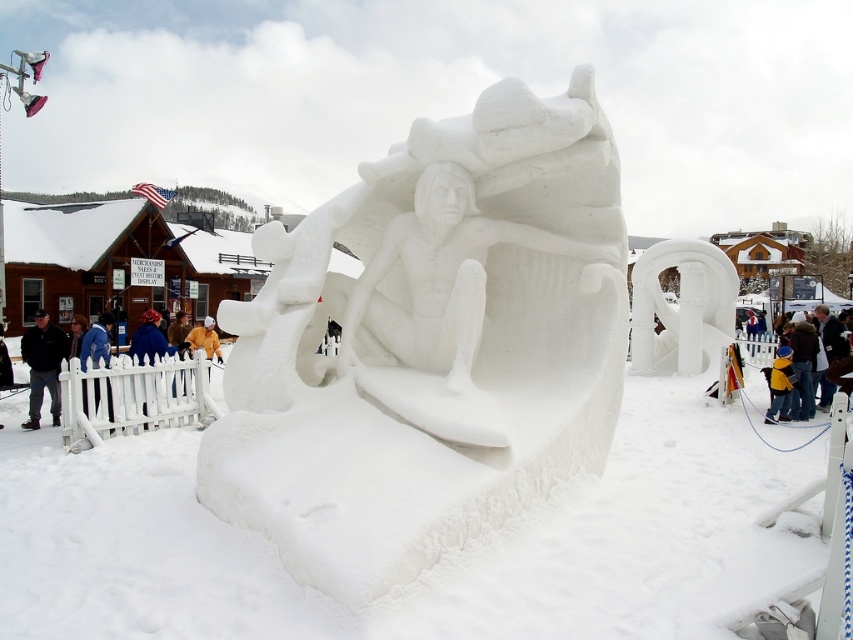
Based on the coordinates provided, where is the white snow sculpture at center located in the image?

The white snow sculpture at center is located at the coordinates point (428, 344).